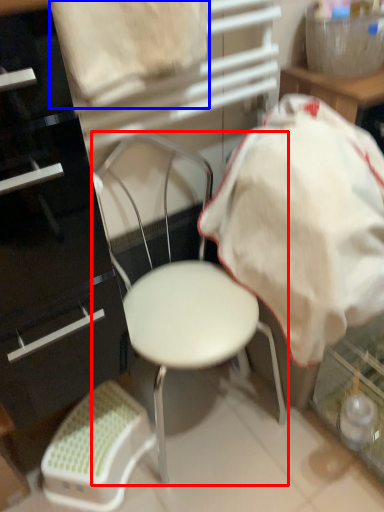
Question: Which object is further to the camera taking this photo, chair (highlighted by a red box) or sheet (highlighted by a blue box)?

Choices:
 (A) chair
 (B) sheet

Answer: (A)